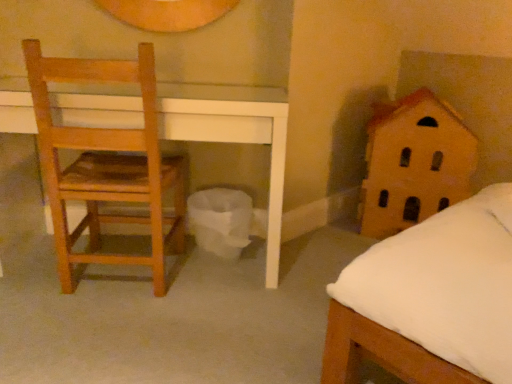
Question: In the image, is wooden house at right positioned in front of or behind wooden chair at left?

Choices:
 (A) behind
 (B) front

Answer: (A)

Question: In terms of size, does wooden house at right appear bigger or smaller than wooden chair at left?

Choices:
 (A) small
 (B) big

Answer: (B)

Question: From a real-world perspective, relative to wooden chair at left, is wooden house at right vertically above or below?

Choices:
 (A) above
 (B) below

Answer: (B)

Question: Based on their sizes in the image, would you say wooden chair at left is bigger or smaller than wooden house at right?

Choices:
 (A) big
 (B) small

Answer: (B)

Question: Considering the positions of point (88, 226) and point (394, 213), is point (88, 226) closer or farther from the camera than point (394, 213)?

Choices:
 (A) closer
 (B) farther

Answer: (A)

Question: From a real-world perspective, is wooden chair at left positioned above or below wooden house at right?

Choices:
 (A) below
 (B) above

Answer: (B)

Question: From their relative heights in the image, would you say wooden chair at left is taller or shorter than wooden house at right?

Choices:
 (A) short
 (B) tall

Answer: (B)